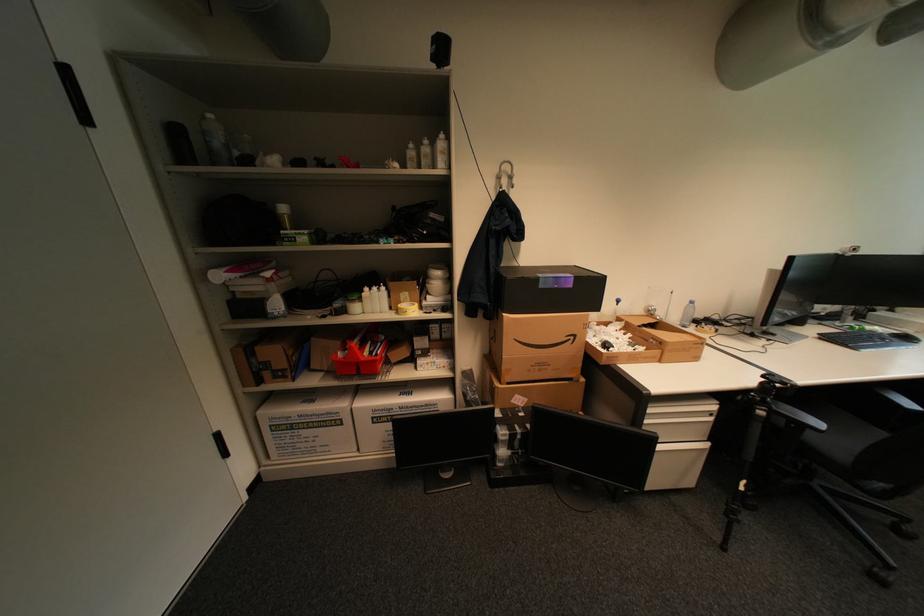
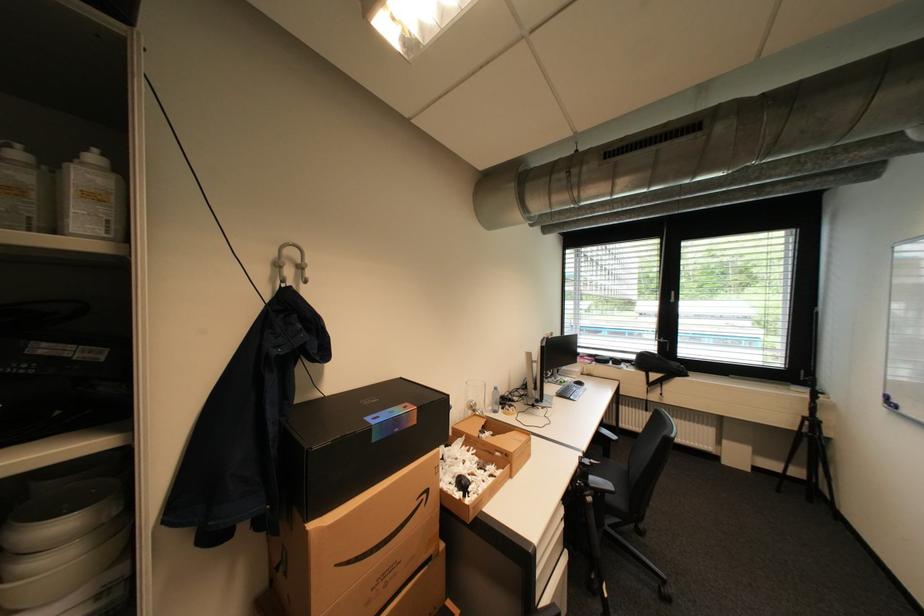
Where in the second image is the point corresponding to (x=580, y=338) from the first image?

(433, 496)